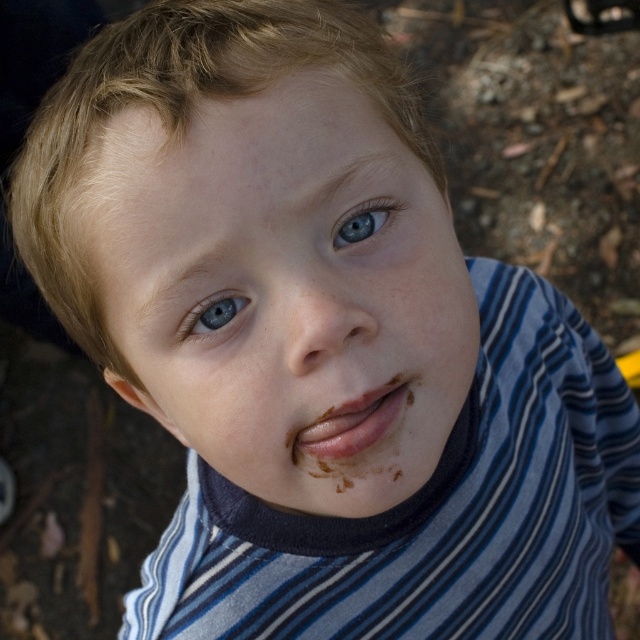
Question: Estimate the real-world distances between objects in this image. Which object is farther from the blue glossy eye at center?

Choices:
 (A) smooth skin face at center
 (B) matte chocolate lips at center
 (C) blue matte eye at upper center

Answer: (A)

Question: Does smooth skin face at center have a greater width compared to blue matte eye at upper center?

Choices:
 (A) yes
 (B) no

Answer: (A)

Question: Is smooth skin face at center thinner than blue glossy eye at center?

Choices:
 (A) no
 (B) yes

Answer: (A)

Question: Which of these objects is positioned farthest from the matte chocolate lips at center?

Choices:
 (A) blue glossy eye at center
 (B) blue matte eye at upper center
 (C) smooth skin face at center

Answer: (A)

Question: Considering the relative positions of smooth skin face at center and blue glossy eye at center in the image provided, where is smooth skin face at center located with respect to blue glossy eye at center?

Choices:
 (A) left
 (B) right

Answer: (B)

Question: Among these points, which one is farthest from the camera?

Choices:
 (A) (234, 304)
 (B) (384, 216)
 (C) (376, 412)

Answer: (B)